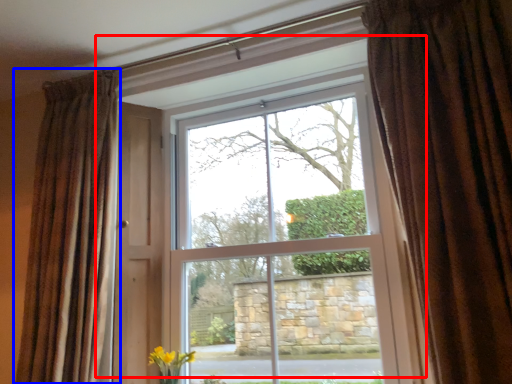
Question: Which of the following is the closest to the observer, window (highlighted by a red box) or curtain (highlighted by a blue box)?

Choices:
 (A) window
 (B) curtain

Answer: (B)